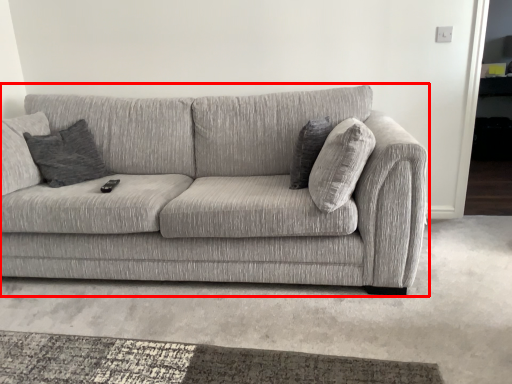
Question: From the image's perspective, what is the correct spatial relationship of studio couch (annotated by the red box) in relation to pillow?

Choices:
 (A) above
 (B) below

Answer: (B)